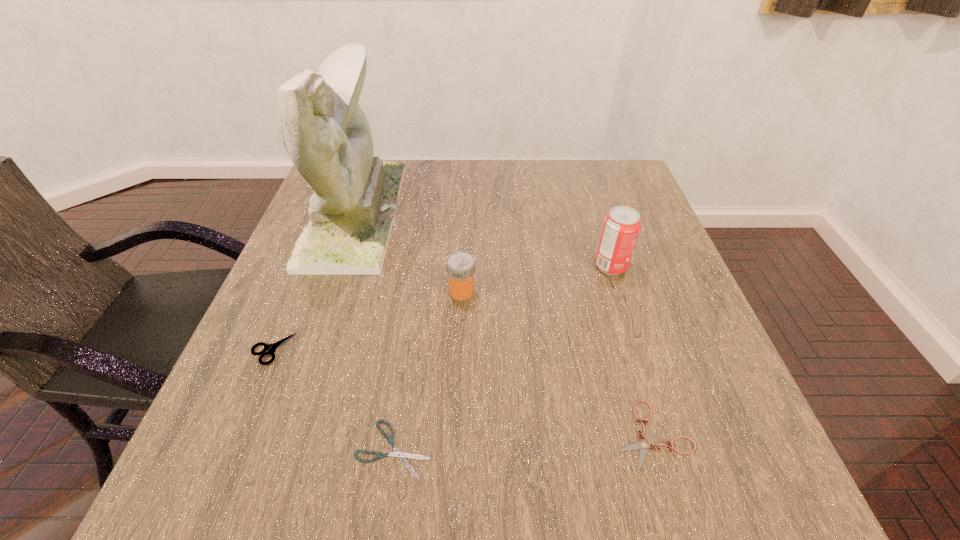
Locate an element on the screen. The width and height of the screenshot is (960, 540). shears that stands as the closest to the second shears from left to right is located at coordinates (270, 348).

The height and width of the screenshot is (540, 960). Find the location of `vacant position in the image that satisfies the following two spatial constraints: 1. on the back side of the tallest shears; 2. on the left side of the soda can`. vacant position in the image that satisfies the following two spatial constraints: 1. on the back side of the tallest shears; 2. on the left side of the soda can is located at coordinates 307,266.

This screenshot has height=540, width=960. In order to click on free spot that satisfies the following two spatial constraints: 1. on the base of the fourth object from right to left; 2. on the left side of the tallest object in this screenshot , I will do `click(275, 448)`.

This screenshot has width=960, height=540. I want to click on free space that satisfies the following two spatial constraints: 1. on the label side of the third farthest object; 2. on the back side of the rightmost shears, so click(456, 435).

The image size is (960, 540). I want to click on blank space that satisfies the following two spatial constraints: 1. on the base of the tallest object; 2. on the left side of the third object from left to right, so click(275, 448).

You are a GUI agent. You are given a task and a screenshot of the screen. Output one action in this format:
    pyautogui.click(x=<x>, y=<y>)
    Task: Click on the vacant space that satisfies the following two spatial constraints: 1. on the base of the tallest object; 2. on the right side of the fifth shortest object
    This screenshot has width=960, height=540.
    Given the screenshot: What is the action you would take?
    pos(337,266)

Locate an element on the screen. The image size is (960, 540). blank space that satisfies the following two spatial constraints: 1. on the base of the sculpture; 2. on the back side of the soda can is located at coordinates (337, 266).